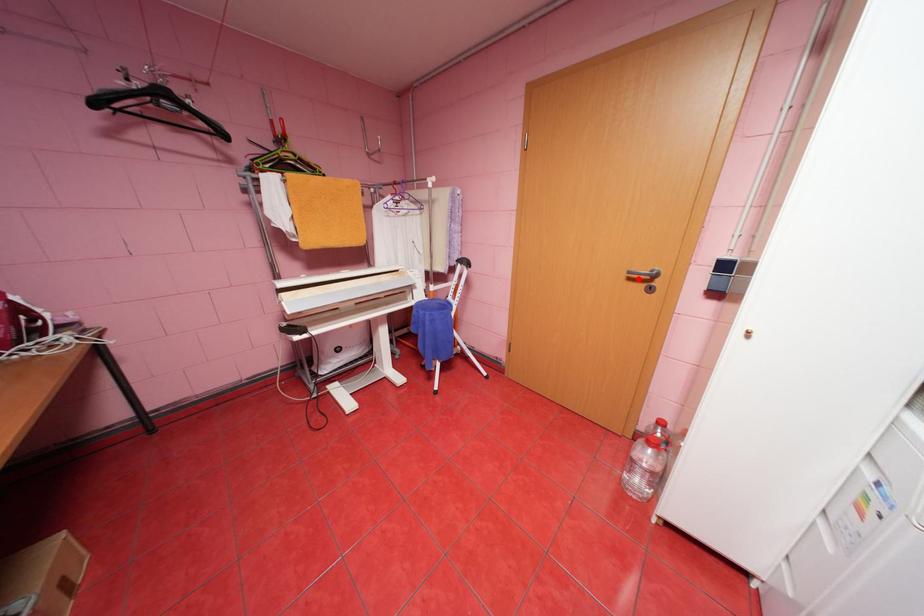
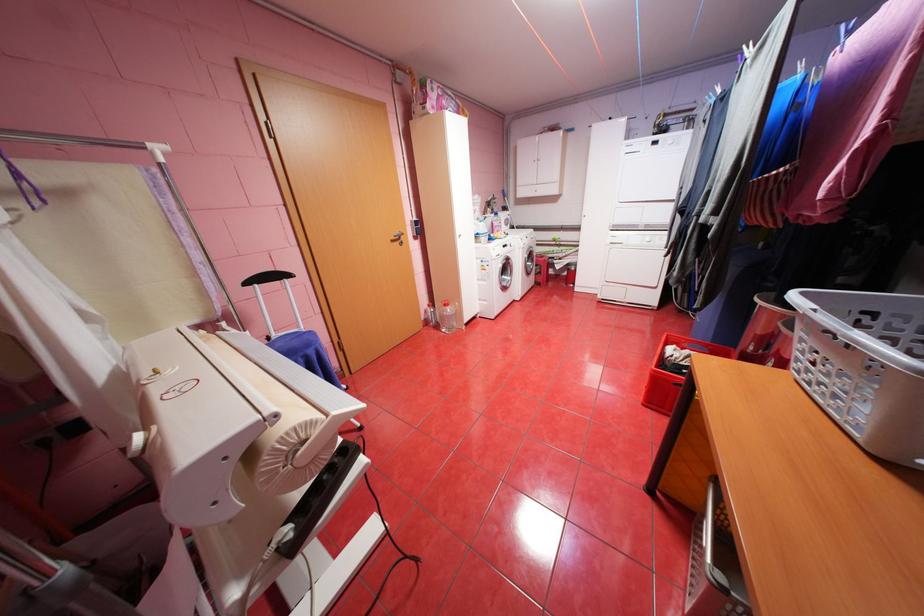
Question: I am providing you with two images of the same scene from different viewpoints. A red point is shown in image1. For the corresponding object point in image2, is it positioned nearer or farther from the camera?

Choices:
 (A) Nearer
 (B) Farther

Answer: (A)